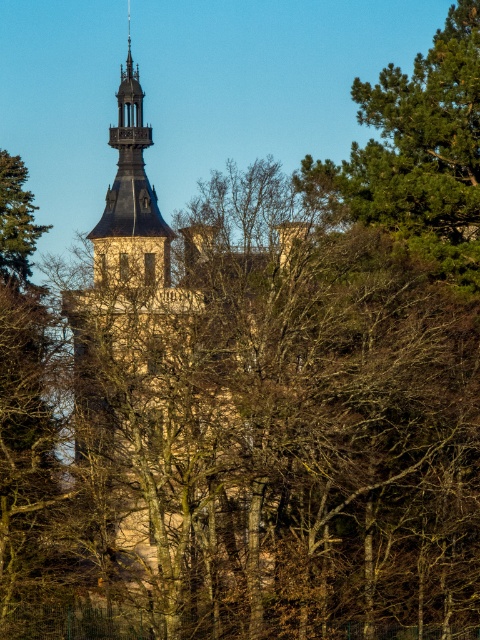
From the picture: Between green needle-like foliage at upper right and green textured pine tree at left, which one has more height?

With more height is green needle-like foliage at upper right.

Is green needle-like foliage at upper right thinner than green textured pine tree at left?

No.

Find the location of a particular element. The width and height of the screenshot is (480, 640). green needle-like foliage at upper right is located at coordinates (417, 154).

Where is `green needle-like foliage at upper right`? Image resolution: width=480 pixels, height=640 pixels. green needle-like foliage at upper right is located at coordinates pyautogui.click(x=417, y=154).

Does green needle-like foliage at upper right have a greater height compared to matte stone tower at upper center?

No, green needle-like foliage at upper right is not taller than matte stone tower at upper center.

Describe the element at coordinates (417, 154) in the screenshot. I see `green needle-like foliage at upper right` at that location.

The image size is (480, 640). Describe the element at coordinates (417, 154) in the screenshot. I see `green needle-like foliage at upper right` at that location.

I want to click on green needle-like foliage at upper right, so click(x=417, y=154).

Does matte stone tower at upper center appear under green textured pine tree at left?

Incorrect, matte stone tower at upper center is not positioned below green textured pine tree at left.

Is matte stone tower at upper center to the left of green textured pine tree at left from the viewer's perspective?

In fact, matte stone tower at upper center is to the right of green textured pine tree at left.

The width and height of the screenshot is (480, 640). I want to click on matte stone tower at upper center, so click(x=131, y=198).